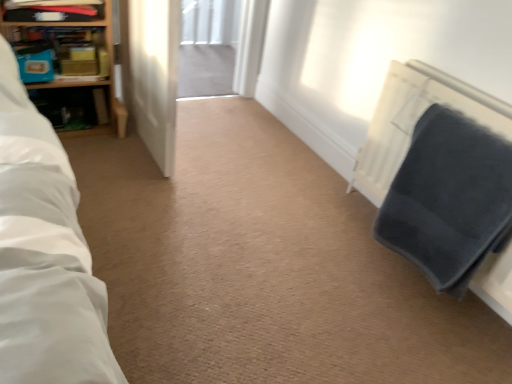
Question: Based on their sizes in the image, would you say transparent glass screen door at center is bigger or smaller than wooden bookshelf at upper left, acting as the second shelf starting from the top?

Choices:
 (A) big
 (B) small

Answer: (A)

Question: Based on their positions, is transparent glass screen door at center located to the left or right of wooden bookshelf at upper left, which is counted as the 1th shelf, starting from the bottom?

Choices:
 (A) right
 (B) left

Answer: (A)

Question: Estimate the real-world distances between objects in this image. Which object is farther from the transparent glass screen door at center?

Choices:
 (A) wooden shelf at upper left, which is the 2th shelf in bottom-to-top order
 (B) wooden bookshelf at upper left, which is counted as the 1th shelf, starting from the bottom
 (C) dark grey textured blanket at right
 (D) wooden bookcase at upper left

Answer: (C)

Question: Which is farther from the wooden bookcase at upper left?

Choices:
 (A) dark grey textured blanket at right
 (B) wooden bookshelf at upper left, acting as the second shelf starting from the top
 (C) transparent glass screen door at center
 (D) wooden shelf at upper left, which appears as the 1th shelf when viewed from the top

Answer: (A)